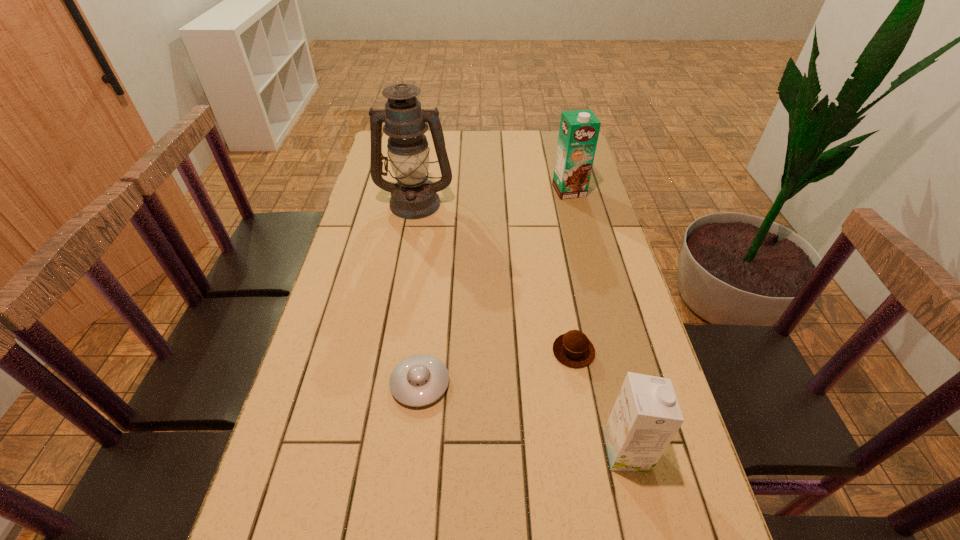
Identify the location of vacant space that satisfies the following two spatial constraints: 1. on the front side of the saucer; 2. on the right side of the third shortest object. (413, 451).

The height and width of the screenshot is (540, 960). I want to click on vacant space that satisfies the following two spatial constraints: 1. on the back side of the saucer; 2. on the left side of the muffin, so click(x=423, y=351).

What are the coordinates of `vacant region that satisfies the following two spatial constraints: 1. on the back side of the farther carton; 2. on the right side of the shorter carton` in the screenshot? It's located at (564, 191).